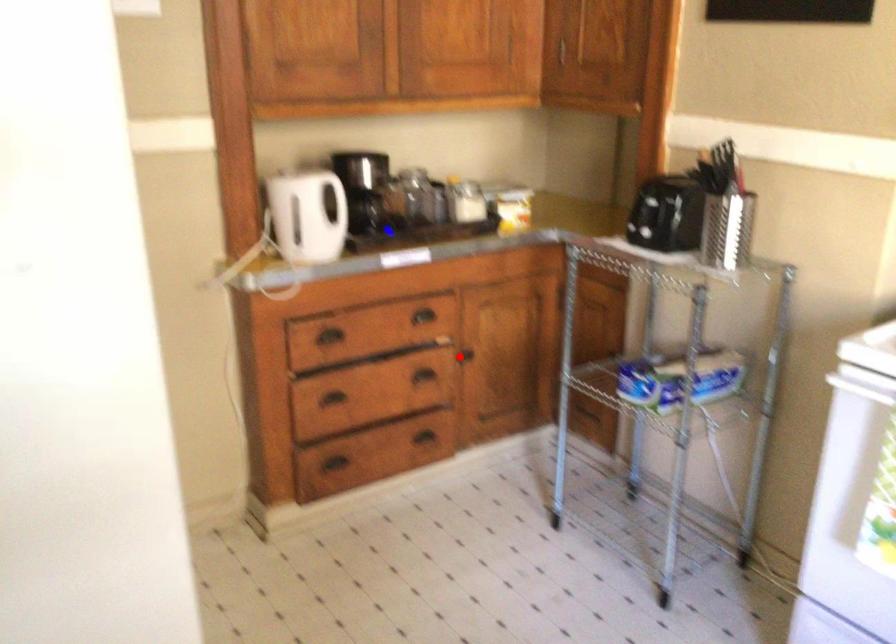
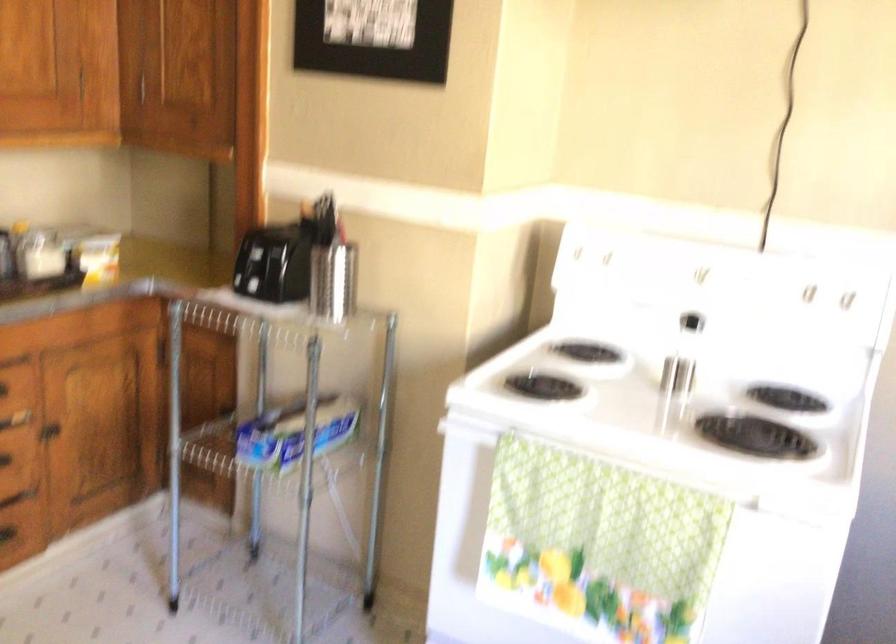
In the second image, find the point that corresponds to the highlighted location in the first image.

(48, 431)